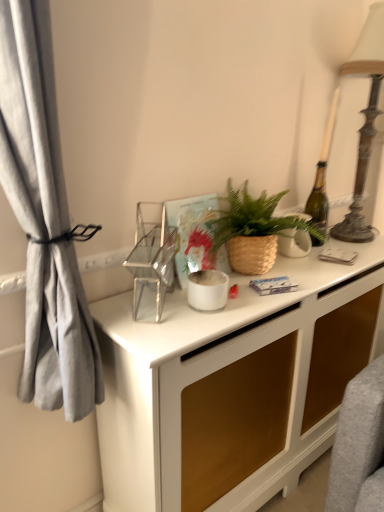
You are a GUI agent. You are given a task and a screenshot of the screen. Output one action in this format:
    pyautogui.click(x=<x>, y=<y>)
    Task: Click on the free space above white glossy desk at center (from a real-world perspective)
    
    Given the screenshot: What is the action you would take?
    pyautogui.click(x=284, y=274)